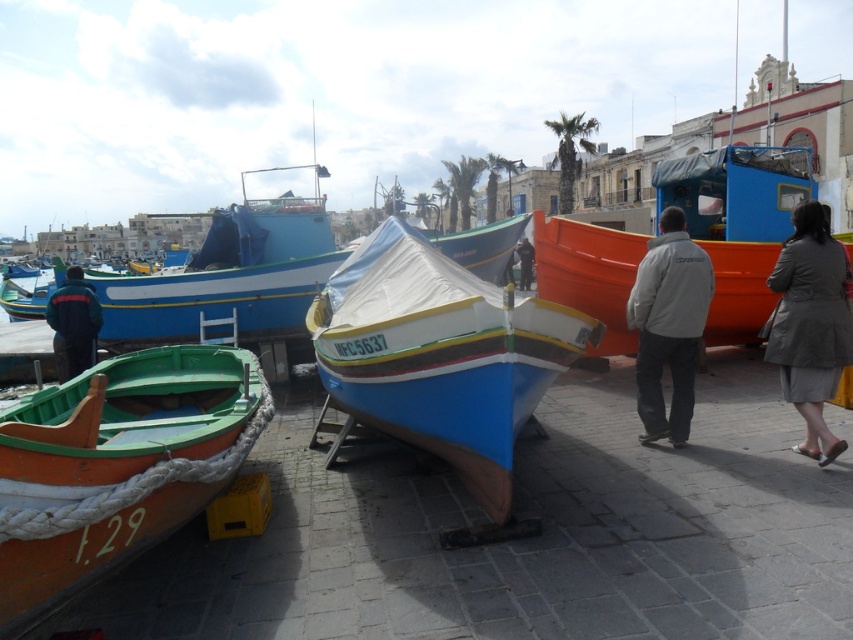
In the scene shown: Can you confirm if orange matte boat at center is smaller than dark gray jacket at center?

Actually, orange matte boat at center might be larger than dark gray jacket at center.

Can you confirm if orange matte boat at center is shorter than dark gray jacket at center?

No.

Is point (782, 157) less distant than point (527, 284)?

Yes, point (782, 157) is closer to viewer.

The height and width of the screenshot is (640, 853). I want to click on orange matte boat at center, so click(x=737, y=224).

Between green polished wood boat at lower left and blue polished wood boat at center, which one is positioned higher?

blue polished wood boat at center is above.

Who is lower down, green polished wood boat at lower left or blue polished wood boat at center?

green polished wood boat at lower left is lower down.

Does point (56, 520) lie in front of point (381, 328)?

Yes, point (56, 520) is in front of point (381, 328).

This screenshot has width=853, height=640. I want to click on green polished wood boat at lower left, so click(115, 465).

Is blue polished wood boat at center closer to camera compared to dark blue jacket at left?

Yes, it is.

Describe the element at coordinates (440, 355) in the screenshot. I see `blue polished wood boat at center` at that location.

Who is more distant from viewer, [485,353] or [70,374]?

Positioned behind is point [70,374].

You are a GUI agent. You are given a task and a screenshot of the screen. Output one action in this format:
    pyautogui.click(x=<x>, y=<y>)
    Task: Click on the blue polished wood boat at center
    The height and width of the screenshot is (640, 853).
    Given the screenshot: What is the action you would take?
    pyautogui.click(x=440, y=355)